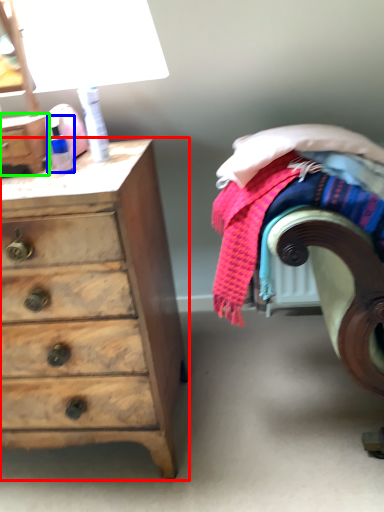
Question: Which is nearer to the chest of drawers (highlighted by a red box)? toiletry (highlighted by a blue box) or chest (highlighted by a green box).

Choices:
 (A) toiletry
 (B) chest

Answer: (B)